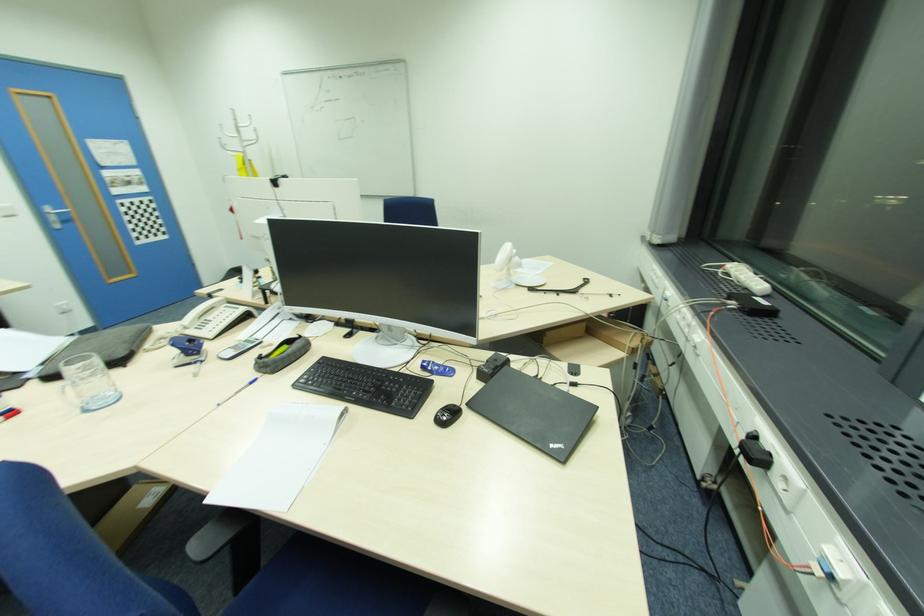
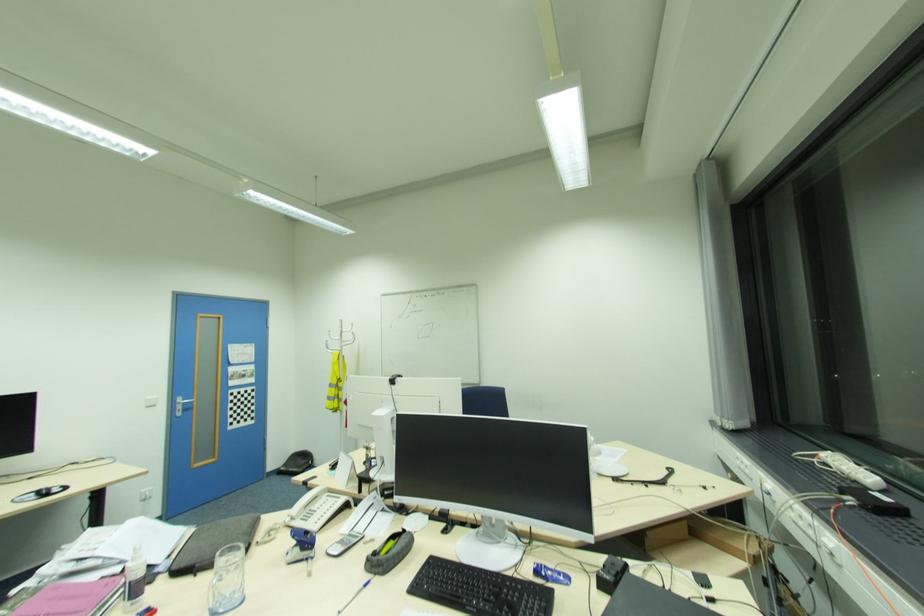
Where in the second image is the point corresponding to (198,363) from the first image?

(310, 559)